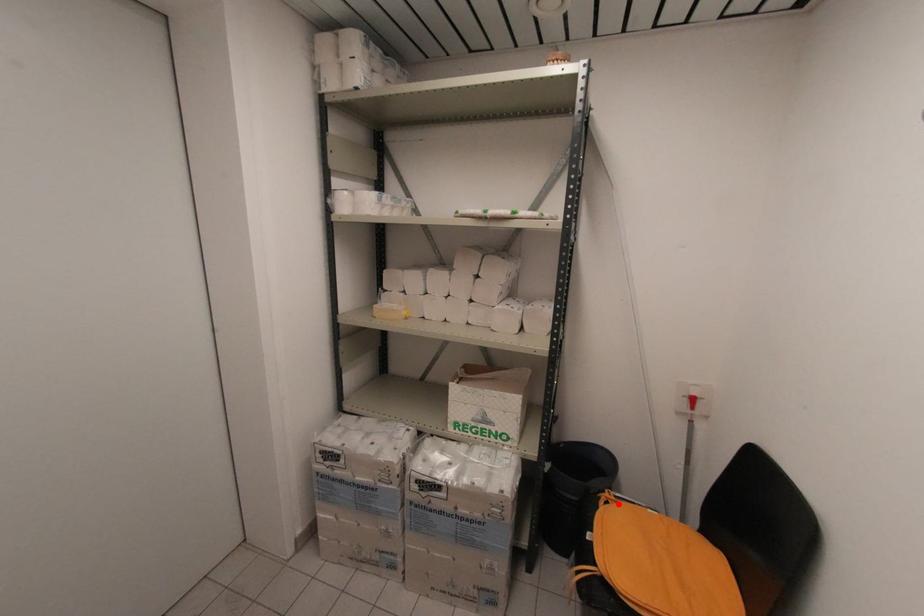
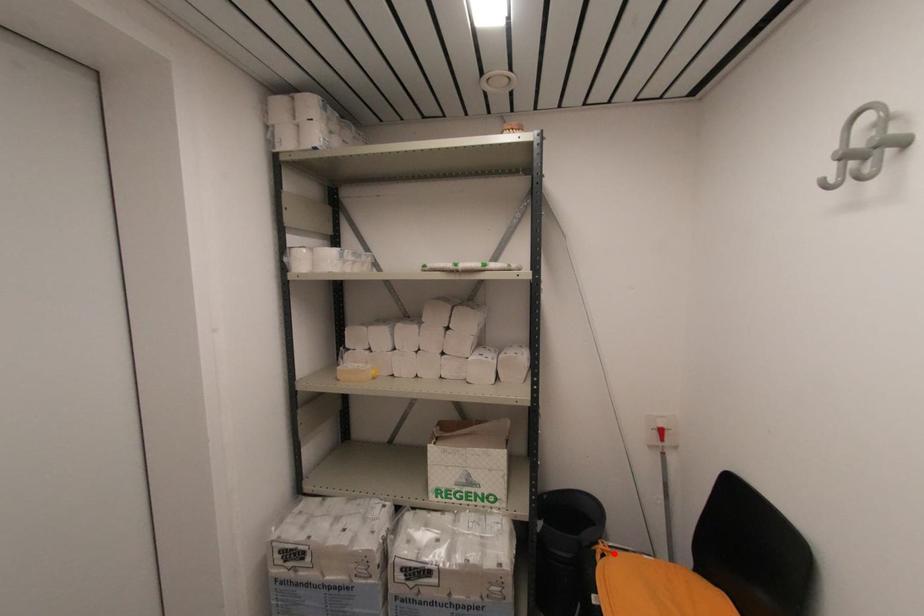
I am providing you with two images of the same scene from different viewpoints. A red point is marked on the first image and another point is marked on the second image. Does the point marked in image1 correspond to the same location as the one in image2?

Yes